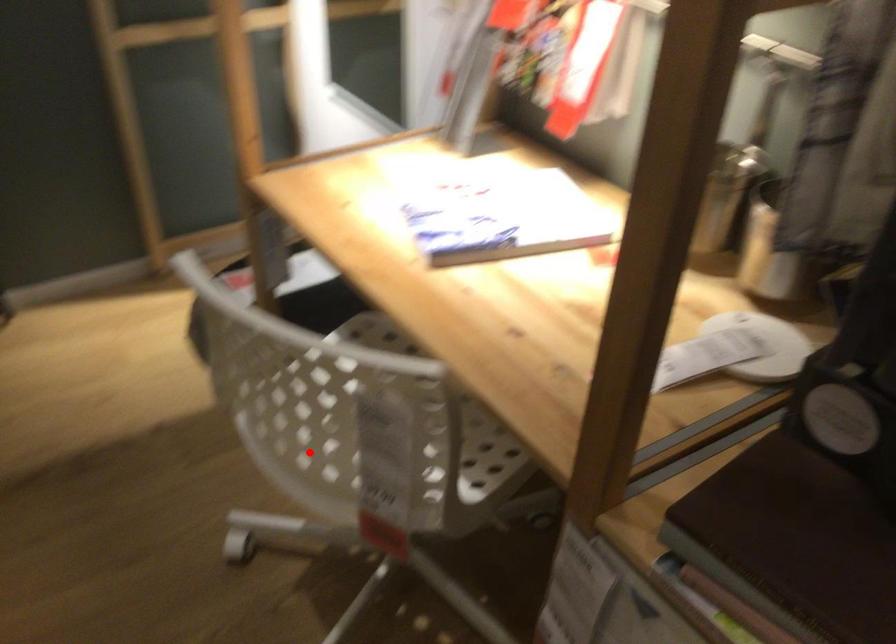
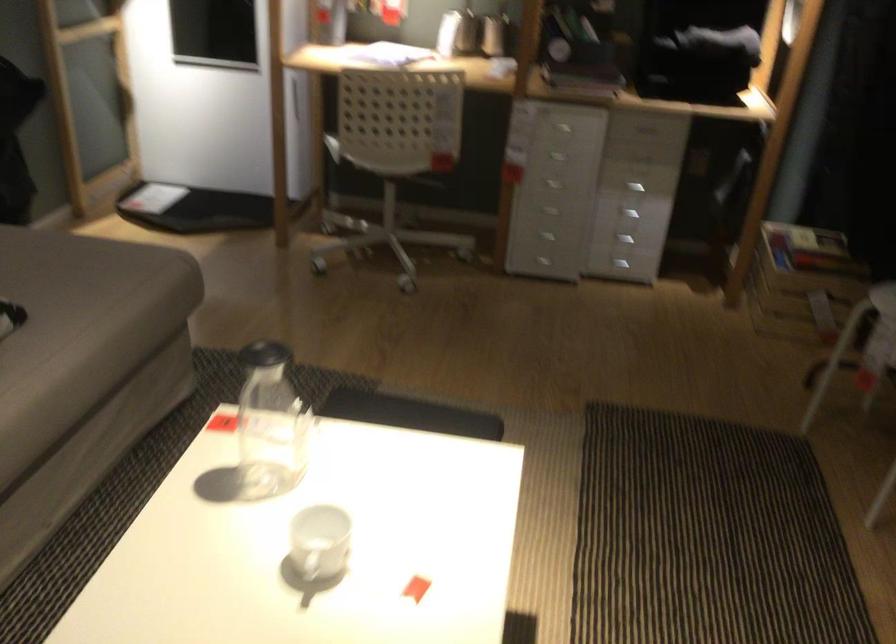
Question: I am providing you with two images of the same scene from different viewpoints. Image1 has a red point marked. In image2, the corresponding 3D location appears at what relative position? Reply with the corresponding letter.

Choices:
 (A) Closer
 (B) Farther

Answer: (B)